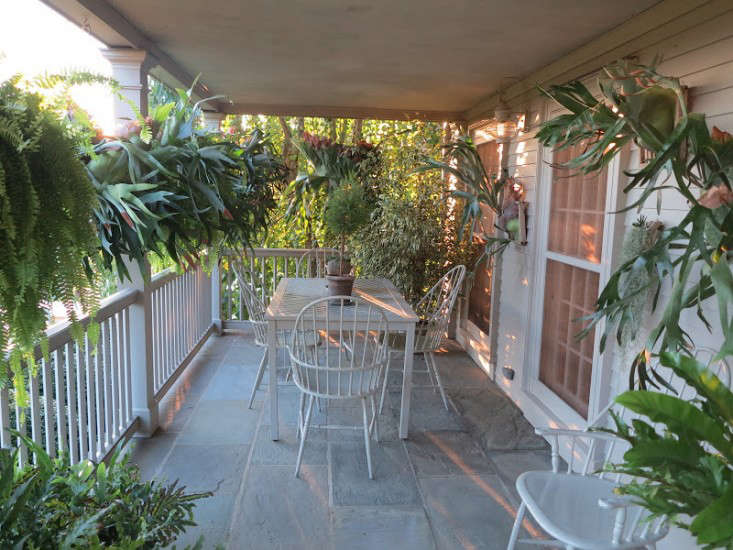
The width and height of the screenshot is (733, 550). In order to click on table in this screenshot , I will do `click(383, 300)`.